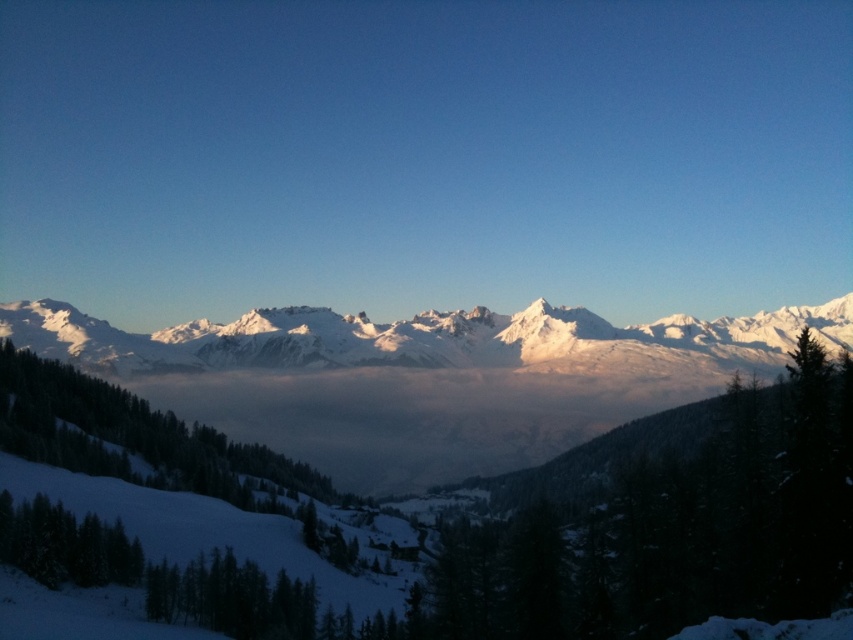
Question: Is white snow-covered mountain range at center to the left of white snow-covered mountains at center from the viewer's perspective?

Choices:
 (A) yes
 (B) no

Answer: (B)

Question: Is white snow-covered mountain range at center behind white snow-covered mountains at center?

Choices:
 (A) yes
 (B) no

Answer: (B)

Question: Is white snow-covered mountain range at center closer to camera compared to white snow-covered mountains at center?

Choices:
 (A) no
 (B) yes

Answer: (B)

Question: Among these objects, which one is farthest from the camera?

Choices:
 (A) white snow-covered mountains at center
 (B) white snow-covered mountain range at center

Answer: (A)